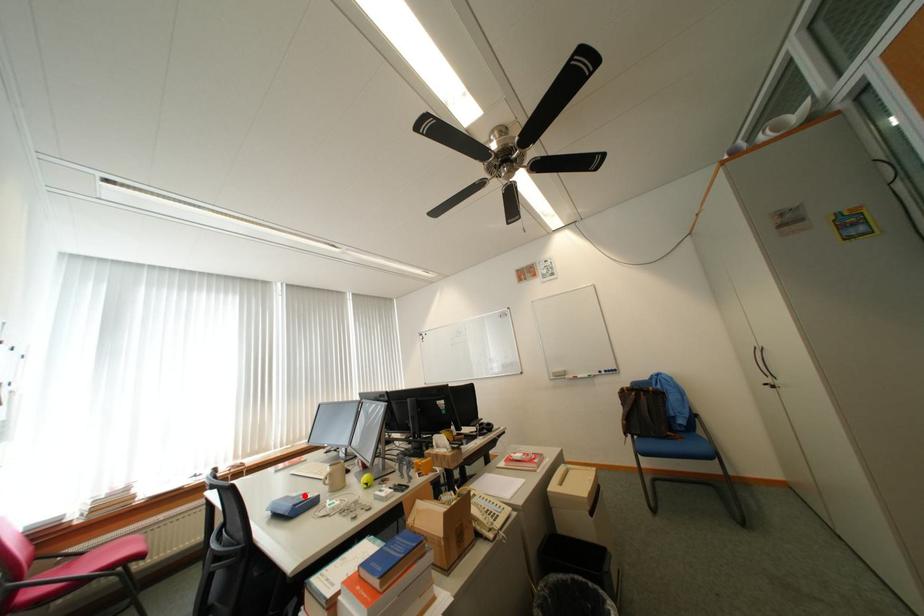
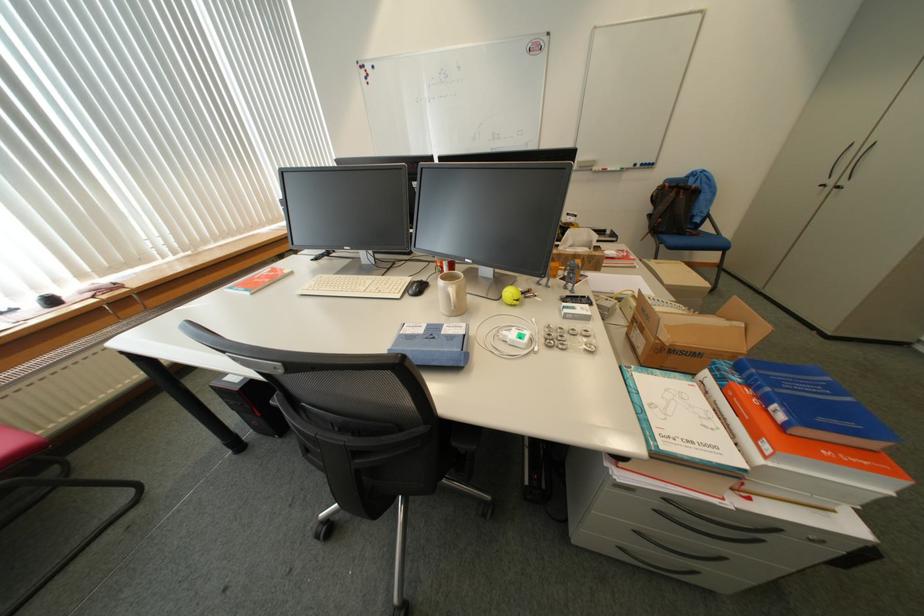
Find the pixel in the second image that matches the highlighted location in the first image.

(430, 331)